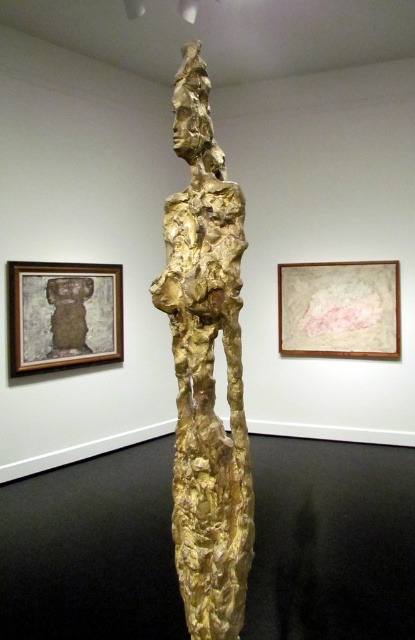
Looking at this image, who is more distant from viewer, (x=107, y=289) or (x=344, y=268)?

The point (x=344, y=268) is behind.

Can you confirm if wooden framed artwork at upper left is positioned above matte pink paper at upper center?

Incorrect, wooden framed artwork at upper left is not positioned above matte pink paper at upper center.

Between point (21, 369) and point (378, 339), which one is positioned behind?

Point (378, 339)

What are the coordinates of `wooden framed artwork at upper left` in the screenshot? It's located at (63, 316).

Is gold textured sculpture at center further to the viewer compared to matte pink paper at upper center?

No, it is not.

Is point (222, 611) farther from camera compared to point (300, 305)?

No, it is in front of (300, 305).

This screenshot has height=640, width=415. What are the coordinates of `gold textured sculpture at center` in the screenshot? It's located at (205, 369).

Which is in front, point (153, 285) or point (61, 317)?

Point (153, 285)

Is gold textured sculpture at center further to the viewer compared to wooden framed artwork at upper left?

That is False.

The image size is (415, 640). What do you see at coordinates (205, 369) in the screenshot?
I see `gold textured sculpture at center` at bounding box center [205, 369].

Find the location of a particular element. The width and height of the screenshot is (415, 640). gold textured sculpture at center is located at coordinates (205, 369).